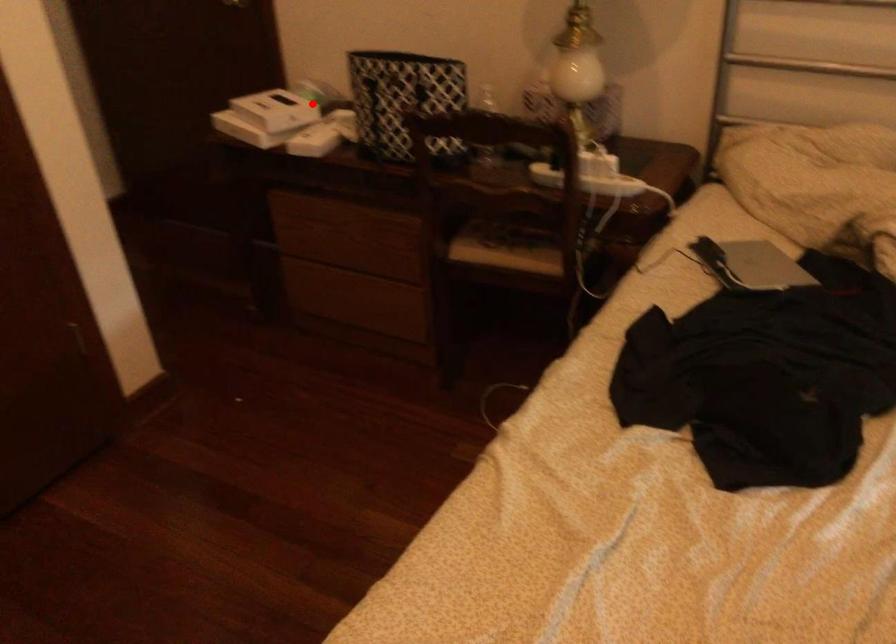
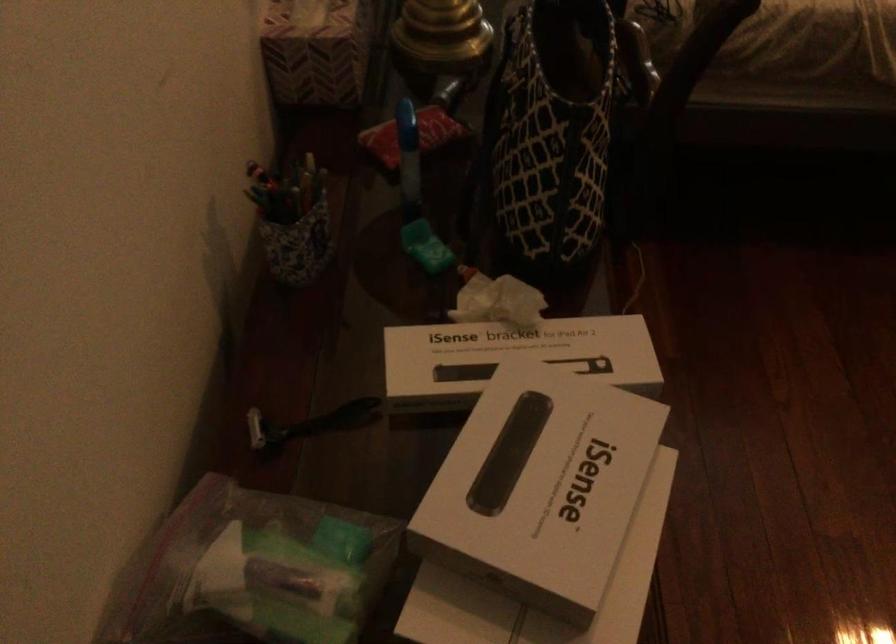
In the second image, find the point that corresponds to the highlighted location in the first image.

(515, 353)